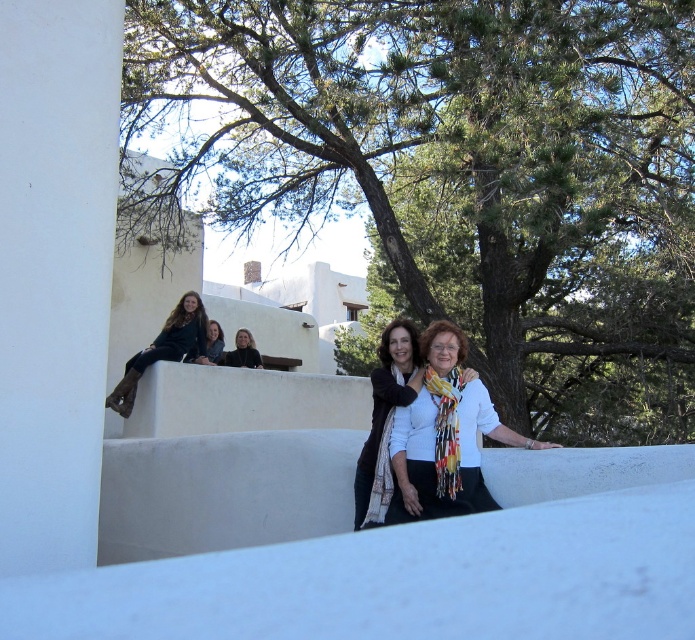
Who is higher up, white scarf at center or dark brown leather boots at upper left?

dark brown leather boots at upper left is higher up.

Is white scarf at center positioned before dark brown leather boots at upper left?

Yes, it is in front of dark brown leather boots at upper left.

Between point (402, 397) and point (188, 300), which one is positioned in front?

Point (402, 397)

I want to click on white scarf at center, so click(384, 419).

Can you confirm if white matte scarf at center is shorter than dark brown leather boots at upper left?

Correct, white matte scarf at center is not as tall as dark brown leather boots at upper left.

Based on the photo, is white matte scarf at center positioned before dark brown leather boots at upper left?

Yes, it is in front of dark brown leather boots at upper left.

This screenshot has width=695, height=640. What do you see at coordinates (443, 436) in the screenshot?
I see `white matte scarf at center` at bounding box center [443, 436].

Where is `white matte scarf at center`? Image resolution: width=695 pixels, height=640 pixels. white matte scarf at center is located at coordinates (443, 436).

Where is `dark brown leather jacket at upper left`? The width and height of the screenshot is (695, 640). dark brown leather jacket at upper left is located at coordinates (243, 352).

Describe the element at coordinates (243, 352) in the screenshot. This screenshot has height=640, width=695. I see `dark brown leather jacket at upper left` at that location.

Locate an element on the screen. dark brown leather jacket at upper left is located at coordinates (243, 352).